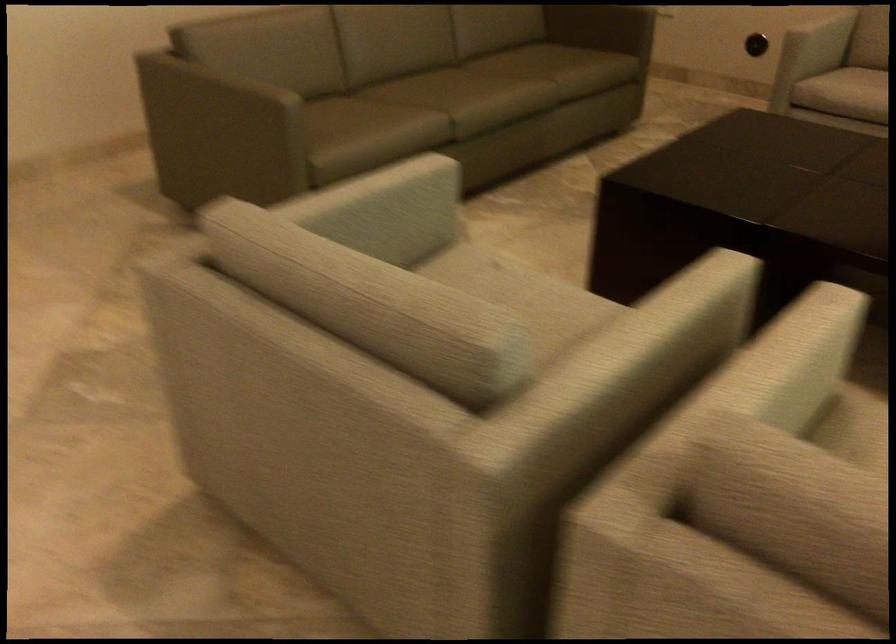
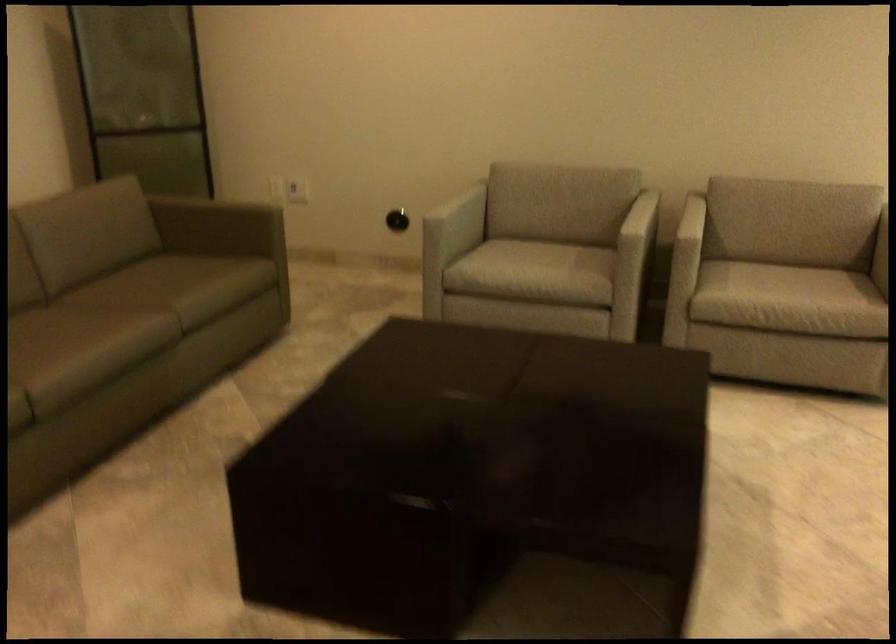
Looking at this image, what movement of the cameraman would produce the second image?

The cameraman walked toward right, forward.